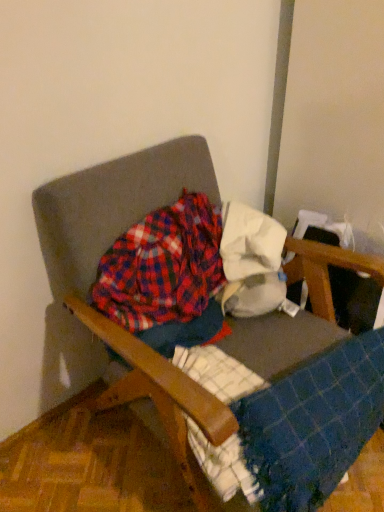
Question: From the image's perspective, would you say blue checkered blanket at lower right is shown under wooden armchair at center?

Choices:
 (A) no
 (B) yes

Answer: (B)

Question: Does blue checkered blanket at lower right have a larger size compared to wooden armchair at center?

Choices:
 (A) yes
 (B) no

Answer: (B)

Question: Is blue checkered blanket at lower right positioned before wooden armchair at center?

Choices:
 (A) yes
 (B) no

Answer: (B)

Question: Is blue checkered blanket at lower right to the right of wooden armchair at center from the viewer's perspective?

Choices:
 (A) no
 (B) yes

Answer: (B)

Question: Considering the relative sizes of blue checkered blanket at lower right and wooden armchair at center in the image provided, is blue checkered blanket at lower right shorter than wooden armchair at center?

Choices:
 (A) yes
 (B) no

Answer: (A)

Question: Looking at the image, does wooden armchair at center seem bigger or smaller compared to blue checkered blanket at lower right?

Choices:
 (A) small
 (B) big

Answer: (B)

Question: From a real-world perspective, is wooden armchair at center physically located above or below blue checkered blanket at lower right?

Choices:
 (A) below
 (B) above

Answer: (B)

Question: Considering the positions of wooden armchair at center and blue checkered blanket at lower right in the image, is wooden armchair at center wider or thinner than blue checkered blanket at lower right?

Choices:
 (A) wide
 (B) thin

Answer: (A)

Question: Considering the relative positions of wooden armchair at center and blue checkered blanket at lower right in the image provided, is wooden armchair at center to the left or to the right of blue checkered blanket at lower right?

Choices:
 (A) left
 (B) right

Answer: (A)

Question: Considering the positions of point (180, 172) and point (110, 266), is point (180, 172) closer or farther from the camera than point (110, 266)?

Choices:
 (A) farther
 (B) closer

Answer: (A)

Question: Considering the positions of wooden armchair at center and plaid fabric at center in the image, is wooden armchair at center wider or thinner than plaid fabric at center?

Choices:
 (A) thin
 (B) wide

Answer: (B)

Question: Based on their sizes in the image, would you say wooden armchair at center is bigger or smaller than plaid fabric at center?

Choices:
 (A) small
 (B) big

Answer: (B)

Question: From a real-world perspective, relative to plaid fabric at center, is wooden armchair at center vertically above or below?

Choices:
 (A) below
 (B) above

Answer: (A)

Question: In terms of width, does blue checkered blanket at lower right look wider or thinner when compared to white cotton cloth at upper right?

Choices:
 (A) thin
 (B) wide

Answer: (A)

Question: From a real-world perspective, is blue checkered blanket at lower right positioned above or below white cotton cloth at upper right?

Choices:
 (A) above
 (B) below

Answer: (B)